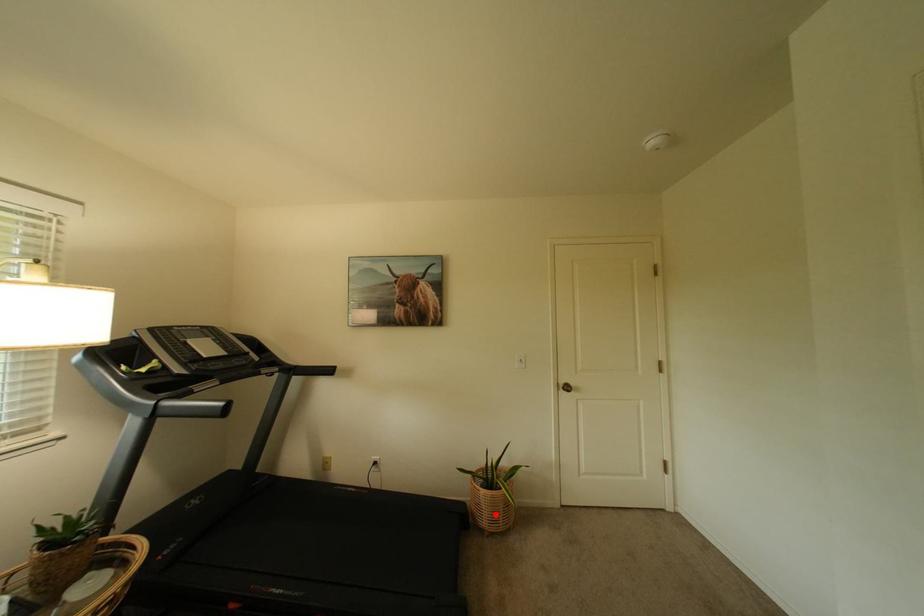
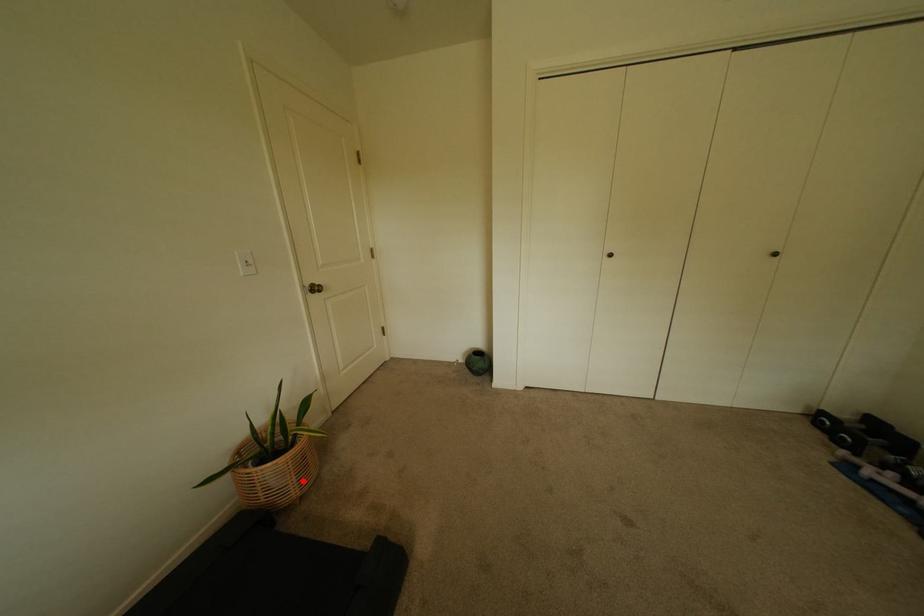
I am providing you with two images of the same scene from different viewpoints. A red point is marked on the first image and another point is marked on the second image. Do the highlighted points in image1 and image2 indicate the same real-world spot?

Yes